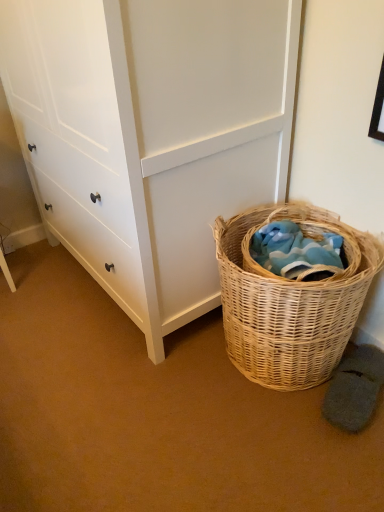
Question: Is white matte chest of drawers at center in front of or behind woven natural basket at lower right in the image?

Choices:
 (A) behind
 (B) front

Answer: (B)

Question: Does point (120, 219) appear closer or farther from the camera than point (329, 348)?

Choices:
 (A) closer
 (B) farther

Answer: (A)

Question: From their relative heights in the image, would you say white matte chest of drawers at center is taller or shorter than woven natural basket at lower right?

Choices:
 (A) tall
 (B) short

Answer: (A)

Question: Considering their positions, is woven natural basket at lower right located in front of or behind white matte chest of drawers at center?

Choices:
 (A) front
 (B) behind

Answer: (B)

Question: Do you think woven natural basket at lower right is within white matte chest of drawers at center, or outside of it?

Choices:
 (A) inside
 (B) outside

Answer: (B)

Question: From a real-world perspective, is woven natural basket at lower right positioned above or below white matte chest of drawers at center?

Choices:
 (A) above
 (B) below

Answer: (B)

Question: Is woven natural basket at lower right taller or shorter than white matte chest of drawers at center?

Choices:
 (A) tall
 (B) short

Answer: (B)